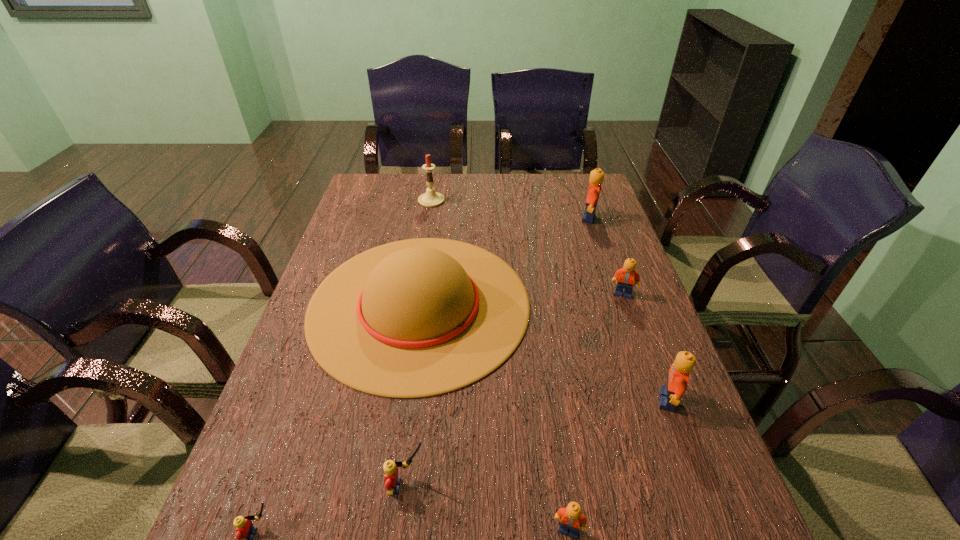
At what (x,y) coordinates should I click in order to perform the action: click on free space located on the front-facing side of the fifth shortest Lego. Please return your answer as a coordinate pair (x, y). This screenshot has height=540, width=960. Looking at the image, I should click on (578, 400).

Locate an element on the screen. vacant position located 0.150m on the front-facing side of the second farthest orange Lego is located at coordinates coord(639,341).

The width and height of the screenshot is (960, 540). I want to click on vacant space located 0.170m on the front-facing side of the third nearest object, so click(x=517, y=486).

The width and height of the screenshot is (960, 540). Identify the location of object that is at the far edge. (431, 198).

Identify the location of object that is at the left edge. This screenshot has width=960, height=540. (415, 318).

Where is `free space at the far edge of the desktop`? The image size is (960, 540). free space at the far edge of the desktop is located at coordinates (516, 190).

You are a GUI agent. You are given a task and a screenshot of the screen. Output one action in this format:
    pyautogui.click(x=<x>, y=<y>)
    Task: Click on the vacant area at the left edge
    The height and width of the screenshot is (540, 960).
    Given the screenshot: What is the action you would take?
    pyautogui.click(x=322, y=409)

Locate an element on the screen. free space at the right edge is located at coordinates (696, 479).

Identify the location of vacant position at the far left corner of the desktop. The height and width of the screenshot is (540, 960). (391, 206).

Locate an element on the screen. The height and width of the screenshot is (540, 960). vacant space at the far right corner is located at coordinates (588, 188).